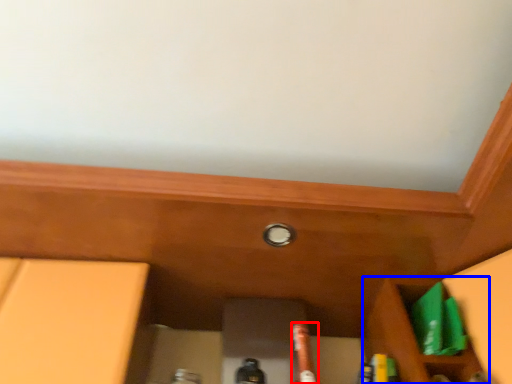
Question: Which object is closer to the camera taking this photo, beer bottle (highlighted by a red box) or cabinetry (highlighted by a blue box)?

Choices:
 (A) beer bottle
 (B) cabinetry

Answer: (A)